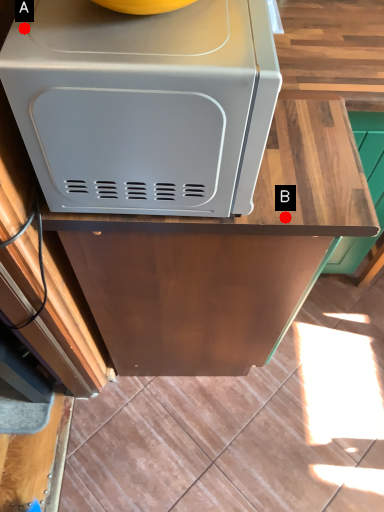
Question: Two points are circled on the image, labeled by A and B beside each circle. Which point appears farthest from the camera in this image?

Choices:
 (A) A is further
 (B) B is further

Answer: (B)